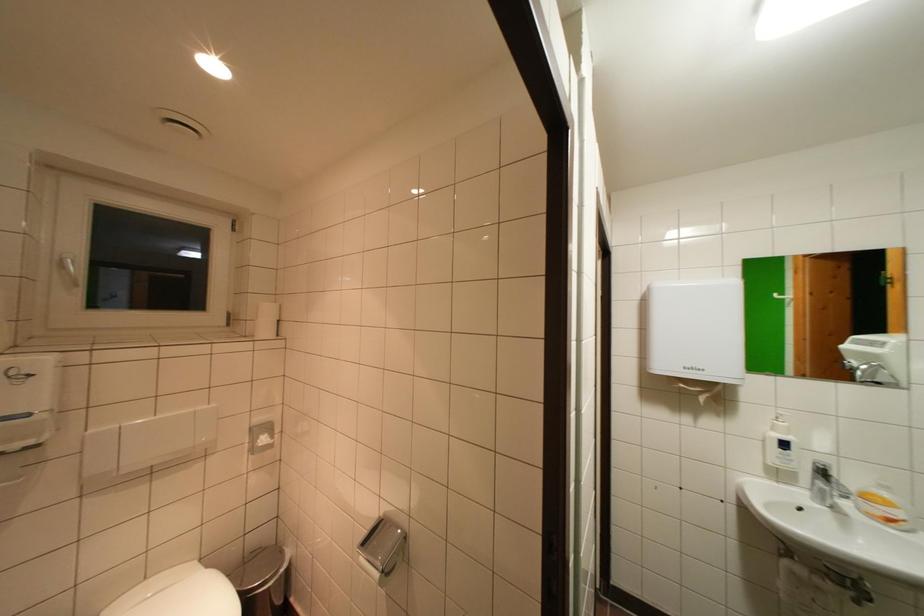
Image resolution: width=924 pixels, height=616 pixels. In order to click on white toilet lid in this screenshot , I will do `click(167, 580)`.